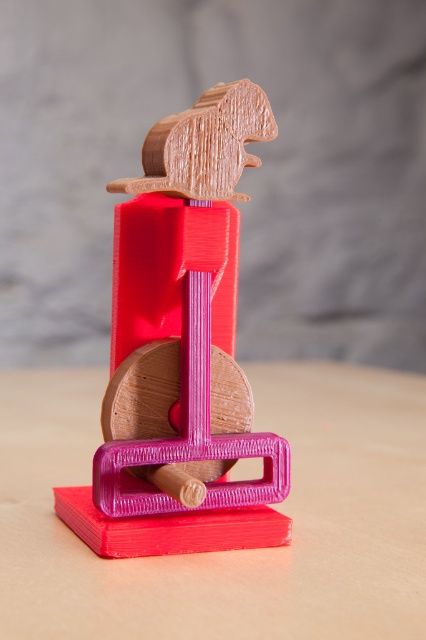
Can you confirm if pink matte table at center is shorter than matte wood mouse at center?

Correct, pink matte table at center is not as tall as matte wood mouse at center.

Does pink matte table at center lie in front of matte wood mouse at center?

Yes, it is.

Which is behind, point (350, 566) or point (132, 492)?

Positioned behind is point (132, 492).

Locate an element on the screen. This screenshot has height=640, width=426. pink matte table at center is located at coordinates (227, 552).